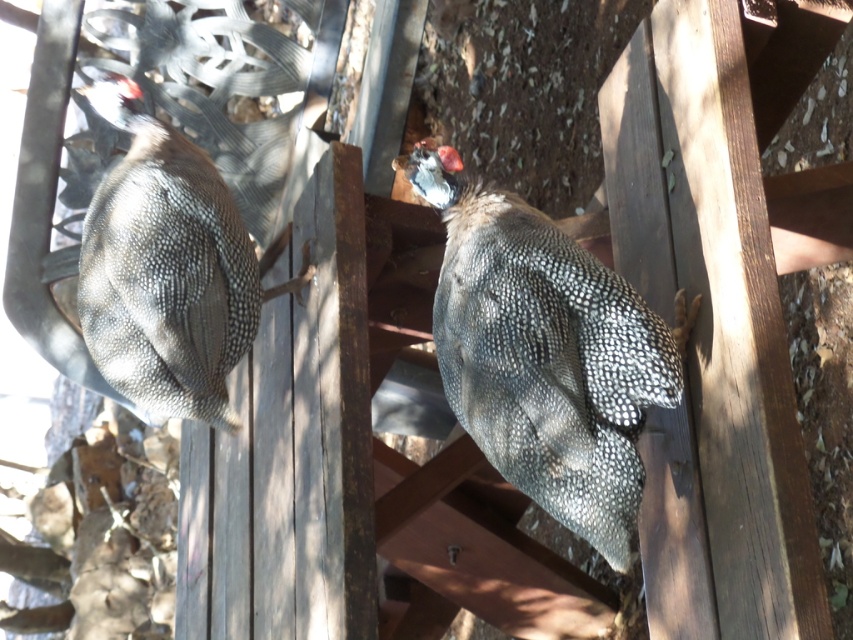
You are a farmer checking on your poultry. You see a pearlized feathered chicken at center and a speckled feathered chicken at left. Which chicken is bigger?

The pearlized feathered chicken at center is larger in size compared to the speckled feathered chicken at left.

You are a bird enthusiast observing two guinea fowl on a wooden deck. You notice a pearlized feathered chicken at center and a speckled feathered chicken at left. How far apart are these two chickens?

The pearlized feathered chicken at center and the speckled feathered chicken at left are 38.40 inches apart.